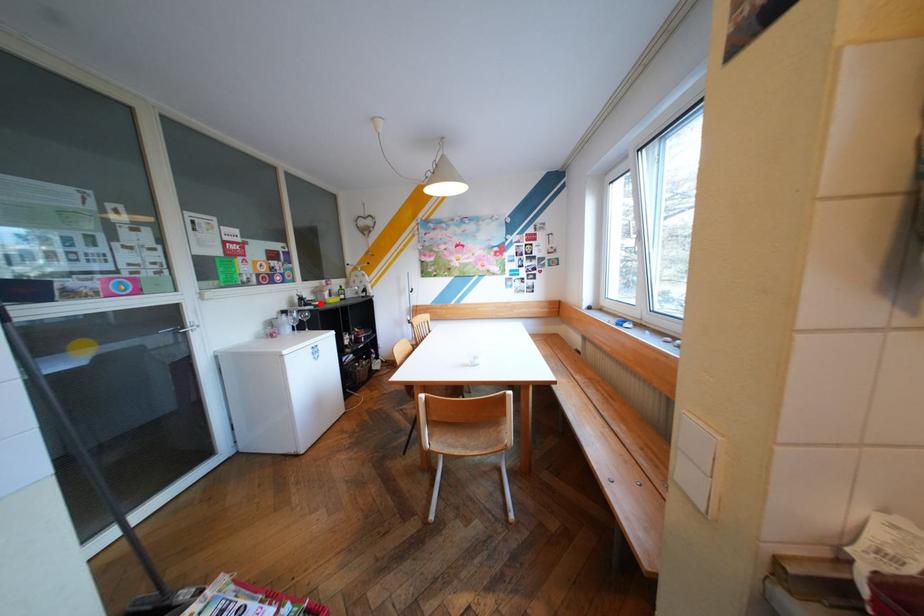
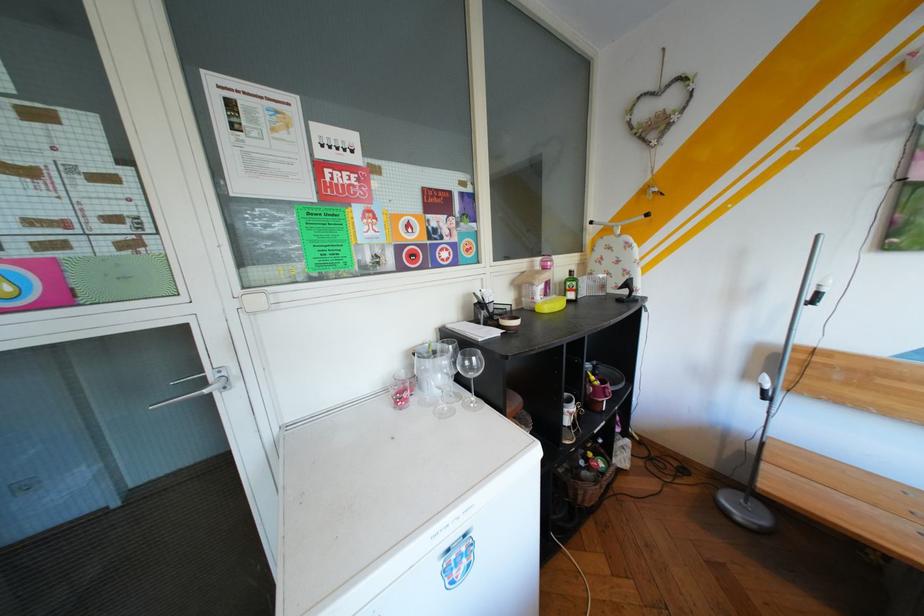
In the second image, find the point that corresponds to the highlighted location in the first image.

(505, 320)